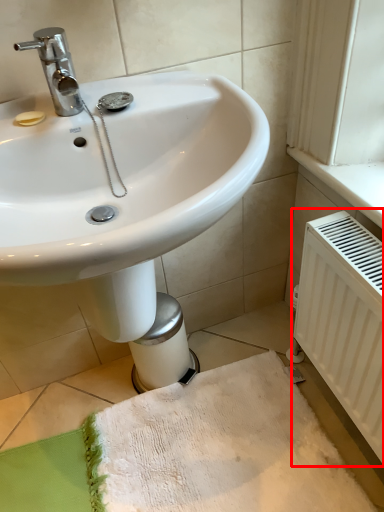
Question: From the image's perspective, where is radiator (annotated by the red box) located in relation to bath towel in the image?

Choices:
 (A) above
 (B) below

Answer: (A)